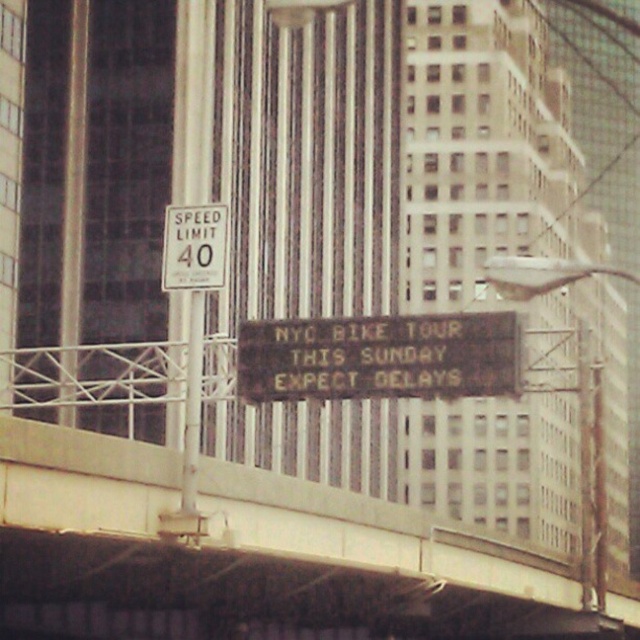
Question: Which point appears farthest from the camera in this image?

Choices:
 (A) (237, 337)
 (B) (196, 221)

Answer: (A)

Question: Can you confirm if black plastic electronic display at center is smaller than white plastic speed limit sign at upper center?

Choices:
 (A) no
 (B) yes

Answer: (A)

Question: Which point appears farthest from the camera in this image?

Choices:
 (A) (168, 253)
 (B) (420, 324)

Answer: (B)

Question: Observing the image, what is the correct spatial positioning of black plastic electronic display at center in reference to white plastic speed limit sign at upper center?

Choices:
 (A) left
 (B) right

Answer: (B)

Question: Where is black plastic electronic display at center located in relation to white plastic speed limit sign at upper center in the image?

Choices:
 (A) below
 (B) above

Answer: (A)